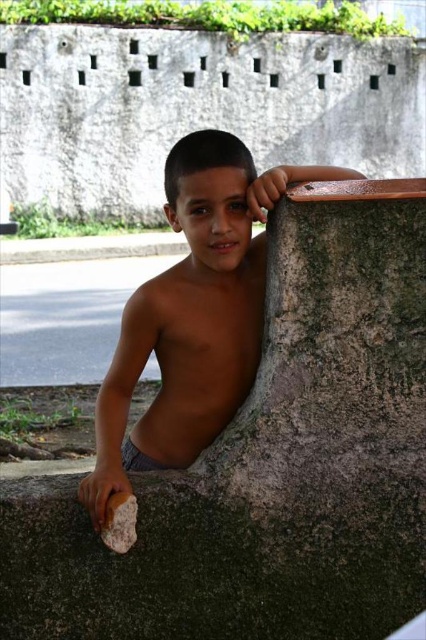
Is point (273, 305) positioned behind point (227, 177)?

No, it is in front of (227, 177).

Who is positioned more to the right, green mossy concrete at upper center or brown matte stone at center?

Positioned to the right is green mossy concrete at upper center.

In order to click on green mossy concrete at upper center in this screenshot , I will do `click(270, 464)`.

Locate an element on the screen. This screenshot has height=640, width=426. green mossy concrete at upper center is located at coordinates 270,464.